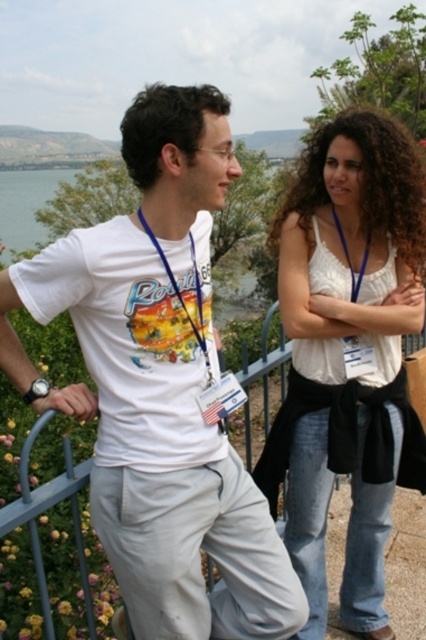
Can you confirm if blue fabric lanyard at center is shorter than blue fabric lanyard at upper right?

No, blue fabric lanyard at center is not shorter than blue fabric lanyard at upper right.

Does blue fabric lanyard at center lie behind blue fabric lanyard at upper right?

No, blue fabric lanyard at center is in front of blue fabric lanyard at upper right.

Describe the element at coordinates (181, 292) in the screenshot. I see `blue fabric lanyard at center` at that location.

Find the location of a particular element. blue fabric lanyard at center is located at coordinates (181, 292).

Measure the distance from white cotton tank top at right to blue fabric lanyard at upper right.

white cotton tank top at right and blue fabric lanyard at upper right are 17.44 inches apart from each other.

Can you confirm if white cotton tank top at right is positioned to the right of blue fabric lanyard at upper right?

No, white cotton tank top at right is not to the right of blue fabric lanyard at upper right.

Who is more distant from viewer, (420, 468) or (351, 276)?

Point (420, 468)

At what (x,y) coordinates should I click in order to perform the action: click on white cotton tank top at right. Please return your answer as a coordinate pair (x, y). The width and height of the screenshot is (426, 640). Looking at the image, I should click on (347, 355).

Does white cotton t-shirt at left have a lesser width compared to blue fabric lanyard at upper right?

No, white cotton t-shirt at left is not thinner than blue fabric lanyard at upper right.

This screenshot has width=426, height=640. Describe the element at coordinates (160, 385) in the screenshot. I see `white cotton t-shirt at left` at that location.

Does point (173, 211) come behind point (351, 275)?

No.

Find the location of a particular element. The height and width of the screenshot is (640, 426). white cotton t-shirt at left is located at coordinates (160, 385).